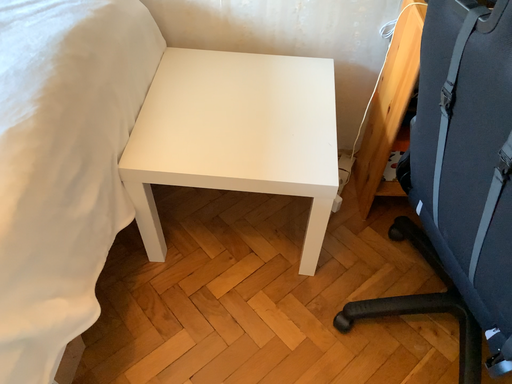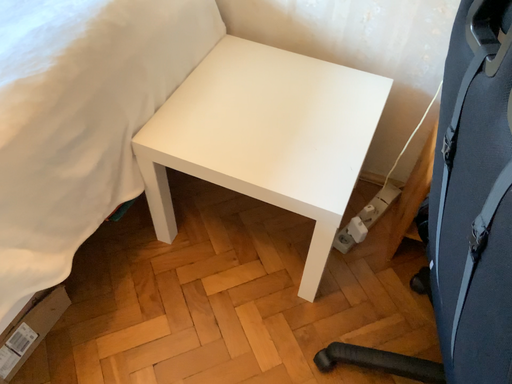
Question: Which way did the camera rotate in the video?

Choices:
 (A) rotated left
 (B) rotated right

Answer: (A)